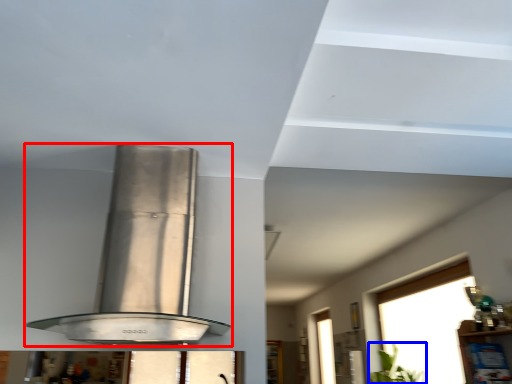
Question: Among these objects, which one is farthest to the camera, kitchen appliance (highlighted by a red box) or plant (highlighted by a blue box)?

Choices:
 (A) kitchen appliance
 (B) plant

Answer: (B)